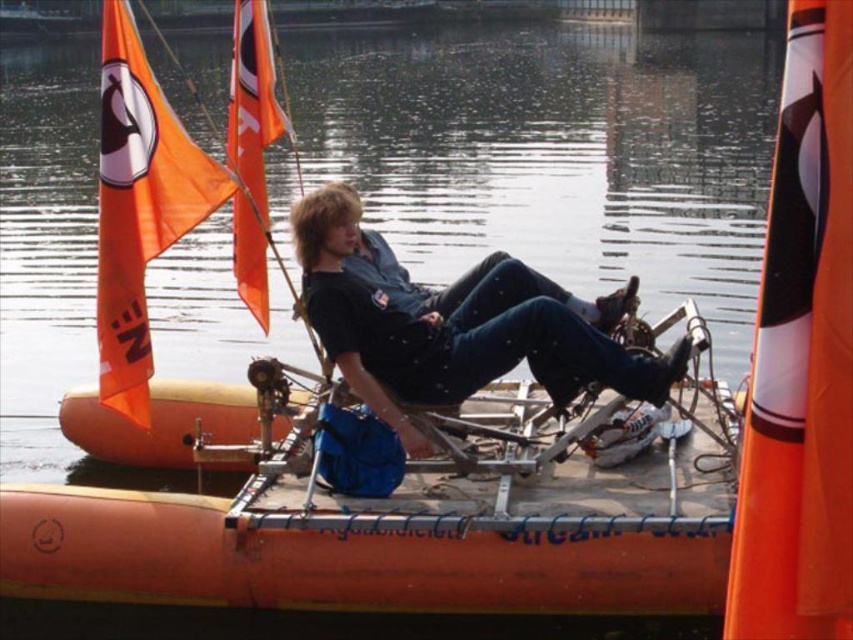
Question: Is transparent water at center to the right of black matte shirt at center from the viewer's perspective?

Choices:
 (A) no
 (B) yes

Answer: (A)

Question: Among these points, which one is nearest to the camera?

Choices:
 (A) (636, 385)
 (B) (473, 198)

Answer: (A)

Question: Which object is farther from the camera taking this photo?

Choices:
 (A) black matte shirt at center
 (B) transparent water at center

Answer: (B)

Question: Is transparent water at center behind black matte shirt at center?

Choices:
 (A) no
 (B) yes

Answer: (B)

Question: Is transparent water at center thinner than black matte shirt at center?

Choices:
 (A) no
 (B) yes

Answer: (A)